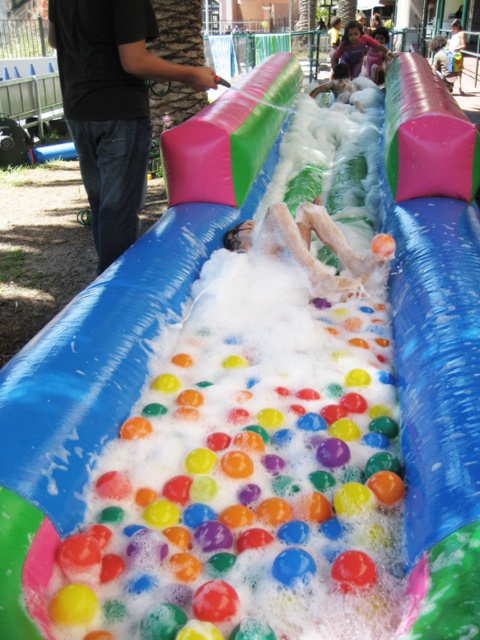
Question: Which point is farther from the camera taking this photo?

Choices:
 (A) (266, 240)
 (B) (358, 65)
 (C) (358, 106)

Answer: (B)

Question: Considering the real-world distances, which object is farthest from the smooth skin girl at upper center?

Choices:
 (A) smooth skin child at center
 (B) smooth skin legs at center

Answer: (B)

Question: Does black jeans at left appear on the left side of smooth skin child at center?

Choices:
 (A) yes
 (B) no

Answer: (A)

Question: Which of the following is the closest to the observer?

Choices:
 (A) black jeans at left
 (B) smooth skin legs at center

Answer: (B)

Question: Is black jeans at left bigger than smooth skin child at center?

Choices:
 (A) yes
 (B) no

Answer: (A)

Question: Does smooth skin legs at center have a lesser width compared to smooth skin girl at upper center?

Choices:
 (A) no
 (B) yes

Answer: (B)